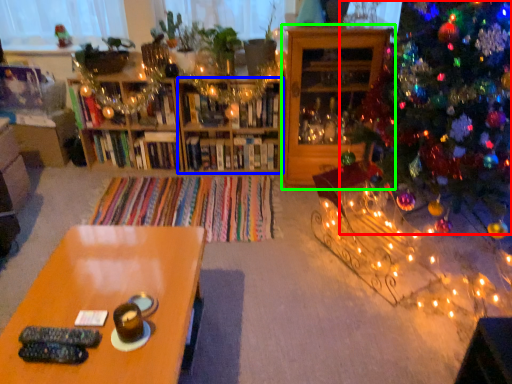
Question: Which is nearer to the christmas tree (highlighted by a red box)? shelf (highlighted by a blue box) or shelf (highlighted by a green box).

Choices:
 (A) shelf
 (B) shelf

Answer: (B)